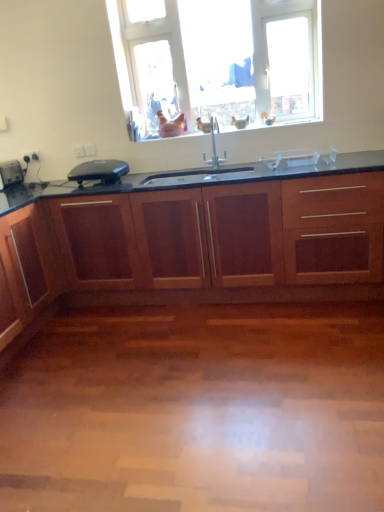
What do you see at coordinates (11, 174) in the screenshot? I see `matte black toaster at left, the first appliance when ordered from left to right` at bounding box center [11, 174].

Measure the distance between clear plastic container at center, the third appliance in the left-to-right sequence, and camera.

clear plastic container at center, the third appliance in the left-to-right sequence, and camera are 8.56 feet apart.

What do you see at coordinates (99, 170) in the screenshot? The height and width of the screenshot is (512, 384). I see `black plastic toaster at left, the second appliance when ordered from left to right` at bounding box center [99, 170].

Find the location of a particular element. The width and height of the screenshot is (384, 512). satin nickel faucet at center is located at coordinates (213, 143).

Which is more to the left, matte black toaster at left, arranged as the 3th appliance when viewed from the right, or satin nickel faucet at center?

From the viewer's perspective, matte black toaster at left, arranged as the 3th appliance when viewed from the right, appears more on the left side.

From the image's perspective, is matte black toaster at left, arranged as the 3th appliance when viewed from the right, positioned above or below satin nickel faucet at center?

matte black toaster at left, arranged as the 3th appliance when viewed from the right, is below satin nickel faucet at center.

Considering the relative sizes of matte black toaster at left, arranged as the 3th appliance when viewed from the right, and satin nickel faucet at center in the image provided, is matte black toaster at left, arranged as the 3th appliance when viewed from the right, thinner than satin nickel faucet at center?

In fact, matte black toaster at left, arranged as the 3th appliance when viewed from the right, might be wider than satin nickel faucet at center.

Which of these two, matte black toaster at left, the first appliance when ordered from left to right, or satin nickel faucet at center, is bigger?

Bigger between the two is satin nickel faucet at center.

In the image, is satin nickel faucet at center on the left side or the right side of clear plastic container at center, which is the 1th appliance in right-to-left order?

Clearly, satin nickel faucet at center is on the left of clear plastic container at center, which is the 1th appliance in right-to-left order, in the image.

Considering the sizes of satin nickel faucet at center and clear plastic container at center, which is the 1th appliance in right-to-left order, in the image, is satin nickel faucet at center taller or shorter than clear plastic container at center, which is the 1th appliance in right-to-left order,?

satin nickel faucet at center is taller than clear plastic container at center, which is the 1th appliance in right-to-left order.

Is satin nickel faucet at center not inside clear plastic container at center, the third appliance in the left-to-right sequence?

Yes, satin nickel faucet at center is not within clear plastic container at center, the third appliance in the left-to-right sequence.

Is satin nickel faucet at center oriented away from clear plastic container at center, which is the 1th appliance in right-to-left order?

No, satin nickel faucet at center is not facing away from clear plastic container at center, which is the 1th appliance in right-to-left order.

From the picture: From a real-world perspective, is clear plastic container at center, the third appliance in the left-to-right sequence, positioned above or below matte black toaster at left, arranged as the 3th appliance when viewed from the right?

In terms of real-world spatial position, clear plastic container at center, the third appliance in the left-to-right sequence, is below matte black toaster at left, arranged as the 3th appliance when viewed from the right.

Could you tell me if clear plastic container at center, the third appliance in the left-to-right sequence, is facing matte black toaster at left, arranged as the 3th appliance when viewed from the right?

No, clear plastic container at center, the third appliance in the left-to-right sequence, is not aimed at matte black toaster at left, arranged as the 3th appliance when viewed from the right.

Does clear plastic container at center, the third appliance in the left-to-right sequence, appear on the right side of matte black toaster at left, the first appliance when ordered from left to right?

Correct, you'll find clear plastic container at center, the third appliance in the left-to-right sequence, to the right of matte black toaster at left, the first appliance when ordered from left to right.

Does clear plastic container at center, which is the 1th appliance in right-to-left order, lie behind matte black toaster at left, the first appliance when ordered from left to right?

No, clear plastic container at center, which is the 1th appliance in right-to-left order, is in front of matte black toaster at left, the first appliance when ordered from left to right.

Is transparent glass window at upper center smaller than satin nickel faucet at center?

Incorrect, transparent glass window at upper center is not smaller in size than satin nickel faucet at center.

Considering the sizes of objects transparent glass window at upper center and satin nickel faucet at center in the image provided, who is taller, transparent glass window at upper center or satin nickel faucet at center?

With more height is transparent glass window at upper center.

Is satin nickel faucet at center at the back of transparent glass window at upper center?

No, transparent glass window at upper center is not facing away from satin nickel faucet at center.

Is transparent glass window at upper center far away from satin nickel faucet at center?

No, there isn't a large distance between transparent glass window at upper center and satin nickel faucet at center.

Does point (10, 180) come behind point (295, 161)?

Yes, point (10, 180) is behind point (295, 161).

Looking at this image, would you consider matte black toaster at left, arranged as the 3th appliance when viewed from the right, to be distant from clear plastic container at center, which is the 1th appliance in right-to-left order?

matte black toaster at left, arranged as the 3th appliance when viewed from the right, is far away from clear plastic container at center, which is the 1th appliance in right-to-left order.

Between matte black toaster at left, the first appliance when ordered from left to right, and clear plastic container at center, the third appliance in the left-to-right sequence, which one has less height?

Standing shorter between the two is clear plastic container at center, the third appliance in the left-to-right sequence.

Is matte black toaster at left, the first appliance when ordered from left to right, to the left or to the right of clear plastic container at center, the third appliance in the left-to-right sequence, in the image?

matte black toaster at left, the first appliance when ordered from left to right, is to the left of clear plastic container at center, the third appliance in the left-to-right sequence.

Considering the positions of objects matte black toaster at left, arranged as the 3th appliance when viewed from the right, and mahogany wood cabinetry at center in the image provided, who is more to the right, matte black toaster at left, arranged as the 3th appliance when viewed from the right, or mahogany wood cabinetry at center?

mahogany wood cabinetry at center is more to the right.

Looking at this image, is matte black toaster at left, arranged as the 3th appliance when viewed from the right, shorter than mahogany wood cabinetry at center?

Correct, matte black toaster at left, arranged as the 3th appliance when viewed from the right, is not as tall as mahogany wood cabinetry at center.

The height and width of the screenshot is (512, 384). Find the location of `the 2nd appliance above the mahogany wood cabinetry at center (from the image's perspective)`. the 2nd appliance above the mahogany wood cabinetry at center (from the image's perspective) is located at coordinates (11, 174).

How many degrees apart are the facing directions of matte black toaster at left, arranged as the 3th appliance when viewed from the right, and mahogany wood cabinetry at center?

They differ by 87.9 degrees in their facing directions.

How many degrees apart are the facing directions of matte black toaster at left, the first appliance when ordered from left to right, and black plastic toaster at left, the second appliance when ordered from left to right?

There is a 89.8-degree angle between the facing directions of matte black toaster at left, the first appliance when ordered from left to right, and black plastic toaster at left, the second appliance when ordered from left to right.

Can you confirm if matte black toaster at left, arranged as the 3th appliance when viewed from the right, is thinner than black plastic toaster at left, placed as the second appliance when sorted from right to left?

Yes.

Based on the photo, from a real-world perspective, is matte black toaster at left, the first appliance when ordered from left to right, under black plastic toaster at left, placed as the second appliance when sorted from right to left?

No.

From the picture: How far apart are matte black toaster at left, arranged as the 3th appliance when viewed from the right, and black plastic toaster at left, placed as the second appliance when sorted from right to left?

The distance of matte black toaster at left, arranged as the 3th appliance when viewed from the right, from black plastic toaster at left, placed as the second appliance when sorted from right to left, is 25.61 inches.

This screenshot has width=384, height=512. What are the coordinates of `faucet lying on the right of matte black toaster at left, arranged as the 3th appliance when viewed from the right` in the screenshot? It's located at (213, 143).

Locate an element on the screen. The height and width of the screenshot is (512, 384). appliance in front of the satin nickel faucet at center is located at coordinates (298, 157).

Which object lies nearer to the anchor point black plastic toaster at left, placed as the second appliance when sorted from right to left, transparent glass window at upper center or mahogany wood cabinetry at center?

mahogany wood cabinetry at center is closer to black plastic toaster at left, placed as the second appliance when sorted from right to left.

Looking at the image, which one is located closer to transparent glass window at upper center, clear plastic container at center, which is the 1th appliance in right-to-left order, or black plastic toaster at left, the second appliance when ordered from left to right?

clear plastic container at center, which is the 1th appliance in right-to-left order, is closer to transparent glass window at upper center.

When comparing their distances from satin nickel faucet at center, does matte black toaster at left, arranged as the 3th appliance when viewed from the right, or mahogany wood cabinetry at center seem closer?

Among the two, mahogany wood cabinetry at center is located nearer to satin nickel faucet at center.

Based on their spatial positions, is clear plastic container at center, which is the 1th appliance in right-to-left order, or mahogany wood cabinetry at center closer to transparent glass window at upper center?

clear plastic container at center, which is the 1th appliance in right-to-left order, is positioned closer to the anchor transparent glass window at upper center.

Estimate the real-world distances between objects in this image. Which object is closer to black plastic toaster at left, placed as the second appliance when sorted from right to left, clear plastic container at center, the third appliance in the left-to-right sequence, or transparent glass window at upper center?

Based on the image, transparent glass window at upper center appears to be nearer to black plastic toaster at left, placed as the second appliance when sorted from right to left.

Which object lies nearer to the anchor point satin nickel faucet at center, mahogany wood cabinetry at center or clear plastic container at center, which is the 1th appliance in right-to-left order?

clear plastic container at center, which is the 1th appliance in right-to-left order, is positioned closer to the anchor satin nickel faucet at center.

Looking at the image, which one is located further to matte black toaster at left, the first appliance when ordered from left to right, clear plastic container at center, which is the 1th appliance in right-to-left order, or transparent glass window at upper center?

clear plastic container at center, which is the 1th appliance in right-to-left order.

From the picture: Estimate the real-world distances between objects in this image. Which object is further from satin nickel faucet at center, clear plastic container at center, the third appliance in the left-to-right sequence, or black plastic toaster at left, the second appliance when ordered from left to right?

The object further to satin nickel faucet at center is black plastic toaster at left, the second appliance when ordered from left to right.

This screenshot has width=384, height=512. I want to click on faucet between matte black toaster at left, the first appliance when ordered from left to right, and transparent glass window at upper center, in the horizontal direction, so click(x=213, y=143).

At what (x,y) coordinates should I click in order to perform the action: click on appliance situated between matte black toaster at left, the first appliance when ordered from left to right, and satin nickel faucet at center from left to right. Please return your answer as a coordinate pair (x, y). The image size is (384, 512). Looking at the image, I should click on (99, 170).

In order to click on window situated between black plastic toaster at left, placed as the second appliance when sorted from right to left, and clear plastic container at center, which is the 1th appliance in right-to-left order, from left to right in this screenshot , I will do `click(225, 59)`.

Image resolution: width=384 pixels, height=512 pixels. In order to click on appliance between matte black toaster at left, the first appliance when ordered from left to right, and clear plastic container at center, which is the 1th appliance in right-to-left order, in the horizontal direction in this screenshot , I will do `click(99, 170)`.